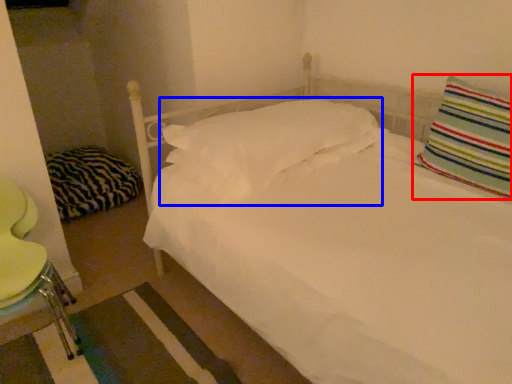
Question: Which object appears farthest to the camera in this image, pillow (highlighted by a red box) or pillow (highlighted by a blue box)?

Choices:
 (A) pillow
 (B) pillow

Answer: (B)